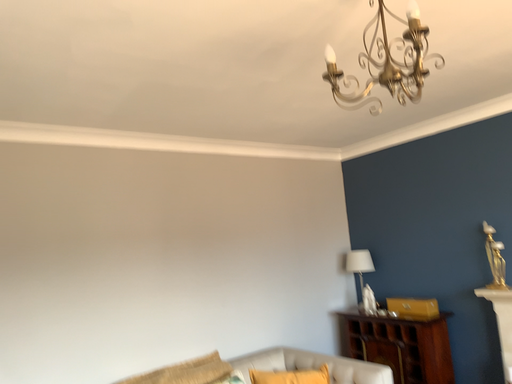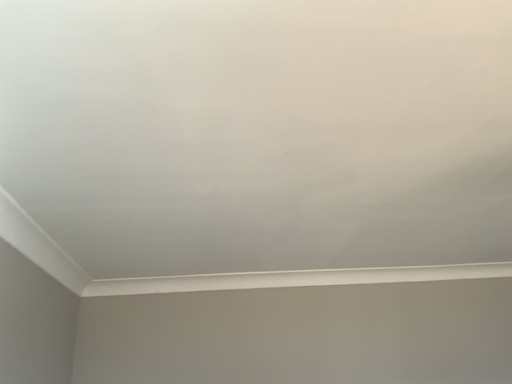
Question: How did the camera likely rotate when shooting the video?

Choices:
 (A) rotated left
 (B) rotated right

Answer: (A)